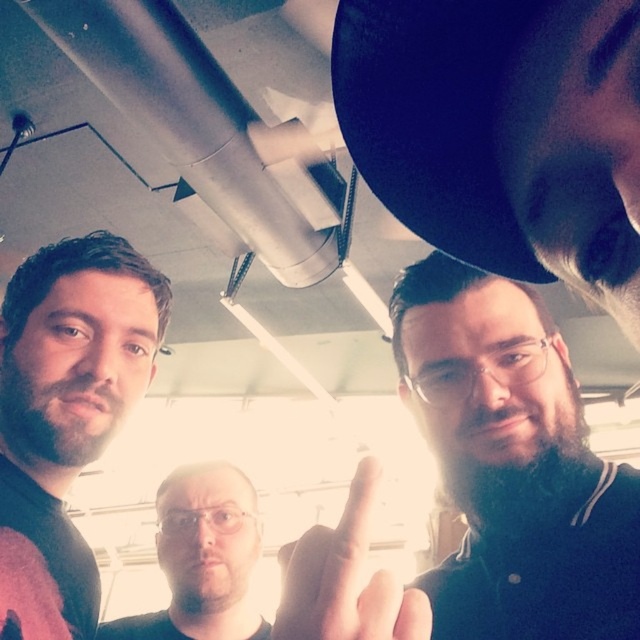
Between dark brown hair at upper center and matte black shirt at left, which one has less height?

Standing shorter between the two is dark brown hair at upper center.

Which is more to the right, dark brown hair at upper center or matte black shirt at left?

dark brown hair at upper center

Locate an element on the screen. dark brown hair at upper center is located at coordinates (513, 465).

Is dark brown hair at upper center positioned in front of clear plastic glasses at center?

Yes, it is.

Based on the photo, does dark brown hair at upper center appear on the right side of clear plastic glasses at center?

Yes, dark brown hair at upper center is to the right of clear plastic glasses at center.

The image size is (640, 640). In order to click on dark brown hair at upper center in this screenshot , I will do `click(513, 465)`.

Which is behind, point (154, 317) or point (349, 576)?

The point (154, 317) is more distant.

Is point (6, 426) positioned after point (305, 572)?

That is True.

Between point (124, 400) and point (348, 550), which one is positioned in front?

Positioned in front is point (348, 550).

This screenshot has height=640, width=640. Find the location of `matte black shirt at left`. matte black shirt at left is located at coordinates point(65,416).